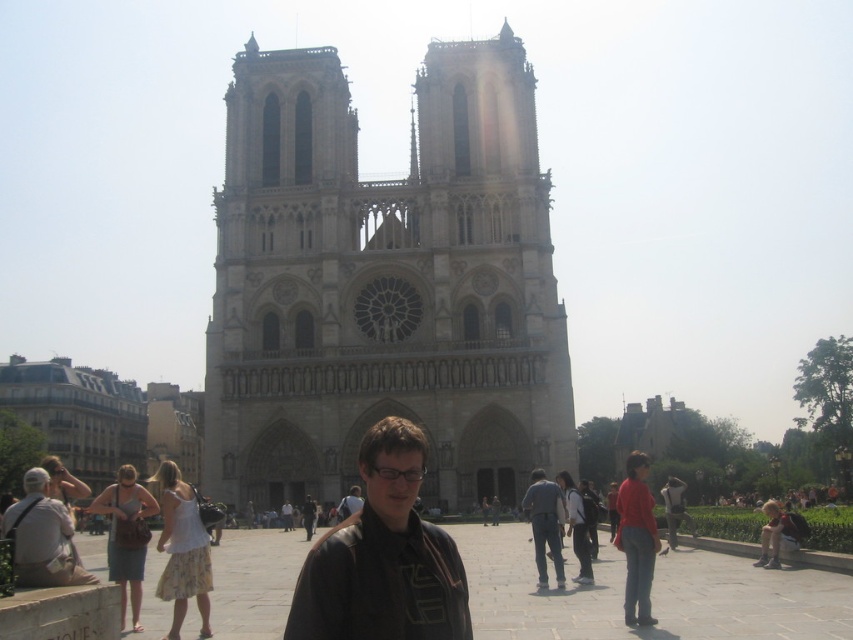
Does denim jeans at center have a smaller size compared to matte brown jacket at center?

Actually, denim jeans at center might be larger than matte brown jacket at center.

How distant is denim jeans at center from matte brown jacket at center?

18.82 meters

Which is behind, point (538, 504) or point (351, 496)?

The point (351, 496) is more distant.

Identify the location of denim jeans at center. The image size is (853, 640). (544, 524).

Is gray stone cathedral at center positioned before denim jeans at center?

That is False.

Does gray stone cathedral at center have a smaller size compared to denim jeans at center?

Incorrect, gray stone cathedral at center is not smaller in size than denim jeans at center.

Is point (460, 291) farther from camera compared to point (550, 548)?

Yes, point (460, 291) is behind point (550, 548).

Find the location of a particular element. gray stone cathedral at center is located at coordinates (383, 282).

Can you confirm if light gray fabric bag at lower left is positioned below denim jeans at center?

Actually, light gray fabric bag at lower left is above denim jeans at center.

Is light gray fabric bag at lower left to the right of denim jeans at center from the viewer's perspective?

In fact, light gray fabric bag at lower left is to the left of denim jeans at center.

Is point (27, 572) closer to viewer compared to point (560, 544)?

Yes, it is.

Locate an element on the screen. The height and width of the screenshot is (640, 853). light gray fabric bag at lower left is located at coordinates (42, 538).